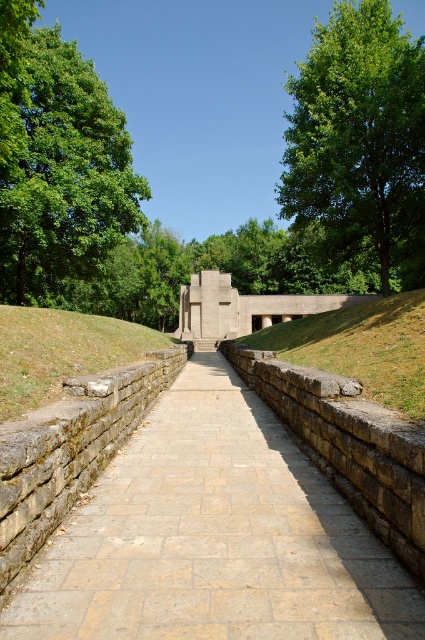
You are a gardener planning to trim the branches of the green leafy tree at left so that they do not overhang the stone paved path at center. Based on the scene description, can you confirm if the tree currently has branches extending over the path?

The stone paved path at center is positioned under green leafy tree at left, which means the tree does have branches extending over the path.